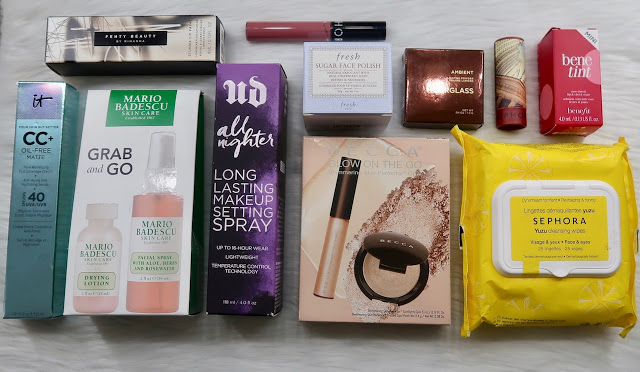
Locate an element on the screen. The width and height of the screenshot is (640, 372). wet wipes is located at coordinates (547, 208).